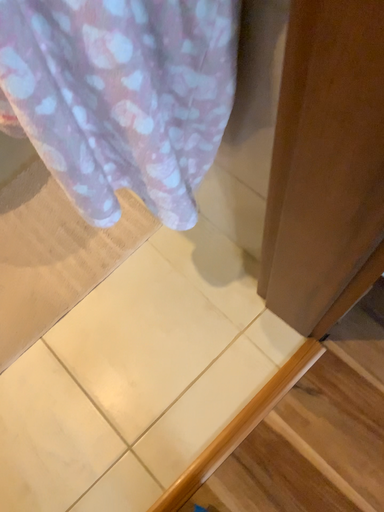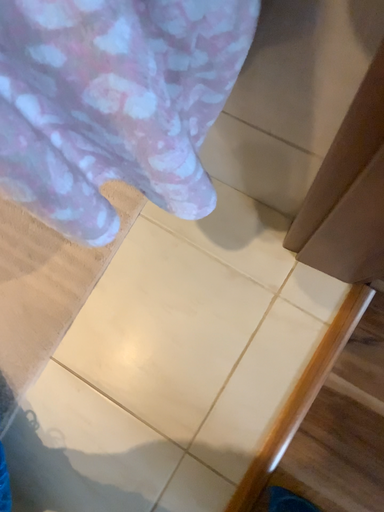
Question: How did the camera likely rotate when shooting the video?

Choices:
 (A) rotated upward
 (B) rotated downward

Answer: (B)